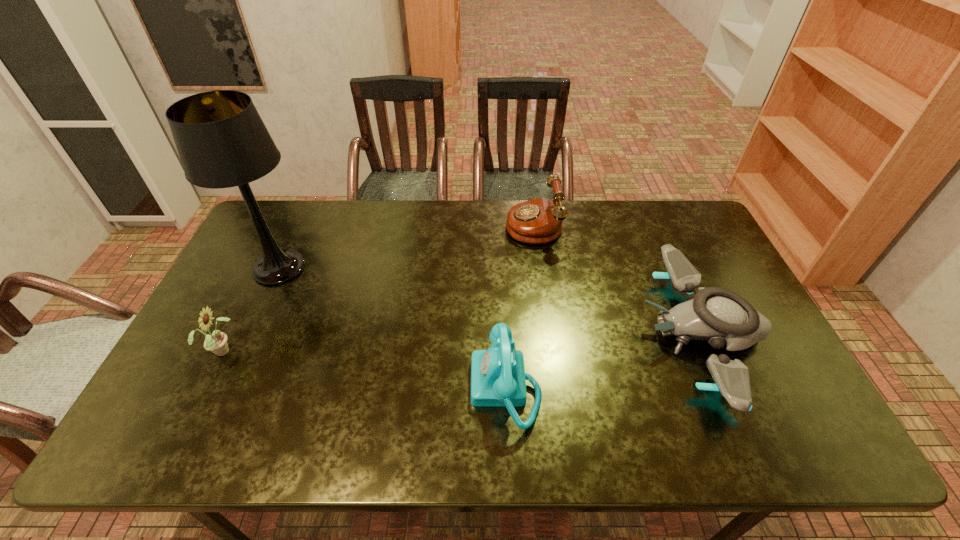
At what (x,y) coordinates should I click in order to perform the action: click on free space located 0.180m on the dial of the farther telephone. Please return your answer as a coordinate pair (x, y). This screenshot has height=540, width=960. Looking at the image, I should click on (455, 223).

Identify the location of vacant space located 0.250m on the front-facing side of the sunflower. (330, 350).

You are a GUI agent. You are given a task and a screenshot of the screen. Output one action in this format:
    pyautogui.click(x=<x>, y=<y>)
    Task: Click on the free space located 0.220m on the dial of the second shortest object
    
    Given the screenshot: What is the action you would take?
    pyautogui.click(x=382, y=388)

What are the coordinates of `free space located on the dial of the second shortest object` in the screenshot? It's located at (402, 388).

Find the location of a particular element. The width and height of the screenshot is (960, 540). vacant space located on the dial of the second shortest object is located at coordinates (398, 388).

You are a GUI agent. You are given a task and a screenshot of the screen. Output one action in this format:
    pyautogui.click(x=<x>, y=<y>)
    Task: Click on the free location located on the front-facing side of the rightmost object
    Image resolution: width=960 pixels, height=540 pixels.
    Given the screenshot: What is the action you would take?
    pyautogui.click(x=620, y=333)

Identify the location of blank area located on the front-facing side of the rightmost object. This screenshot has width=960, height=540. (576, 333).

Identify the location of free spot located 0.260m on the front-facing side of the rightmost object. The width and height of the screenshot is (960, 540). (547, 333).

Where is `object situated at the far edge`? Image resolution: width=960 pixels, height=540 pixels. object situated at the far edge is located at coordinates (537, 221).

I want to click on telephone located at the near edge, so click(x=498, y=379).